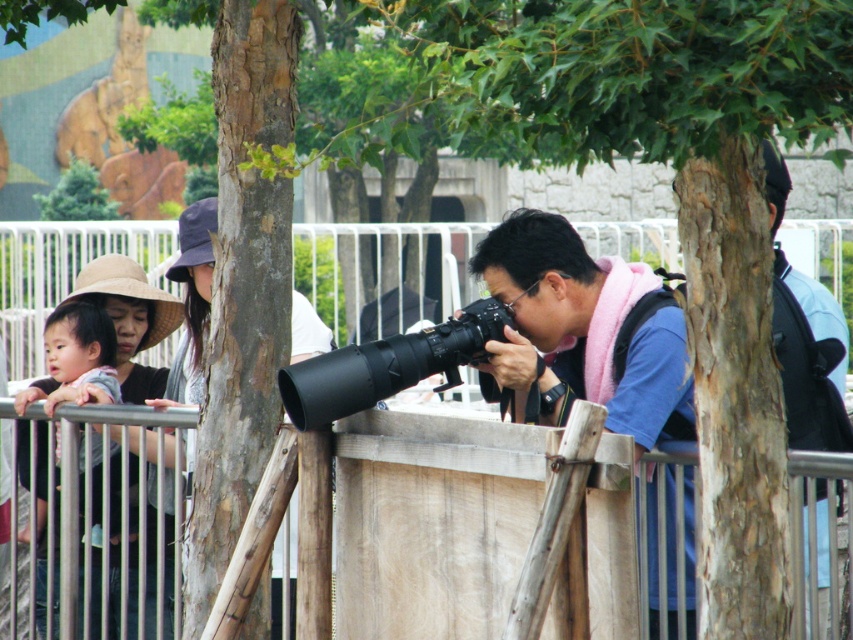
You are a tour guide leading a group through the zoo. You need to ensure that visitors maintain a safe distance of at least 5 meters between themselves and the animals. You notice two visitors, one wearing a dark blue shirt at right and another with a matte black hat at left. Are they violating the safety rules?

The distance between the dark blue shirt at right and matte black hat at left is 4.42 meters, which is less than the required 5 meters. Therefore, they are violating the safety rules.